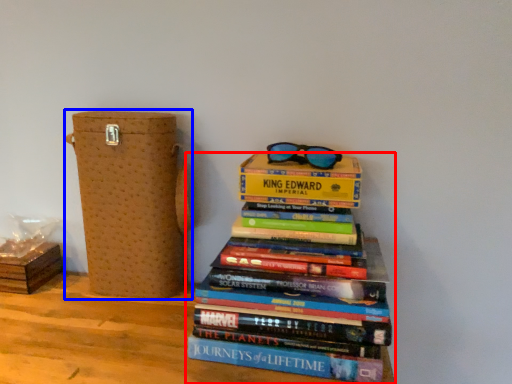
Question: Which of the following is the closest to the observer, book (highlighted by a red box) or cardboard box (highlighted by a blue box)?

Choices:
 (A) book
 (B) cardboard box

Answer: (A)